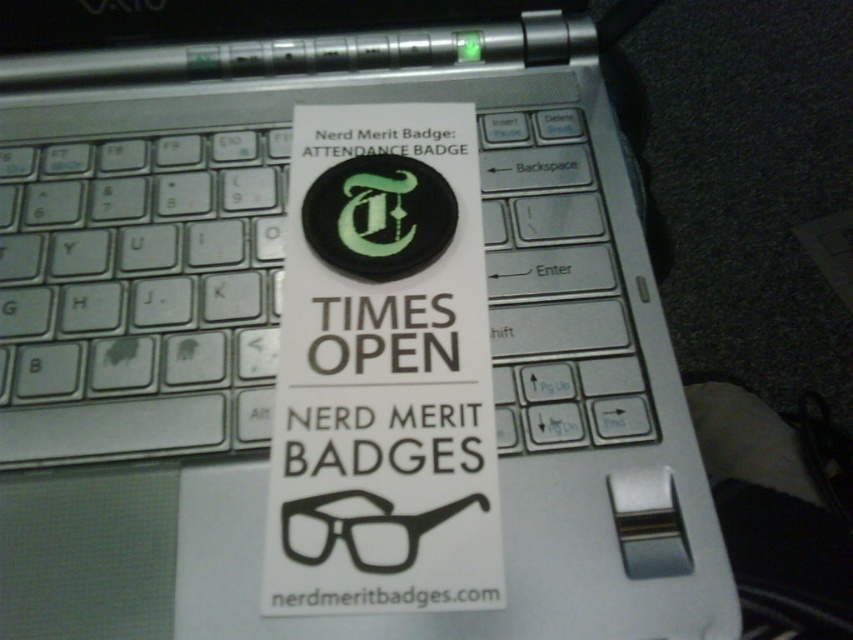
You are trying to see the website address on the black matte glasses at center but there is a white paper sticker at center covering it. Can you see the website address on the glasses?

The white paper sticker at center is in front of the black matte glasses at center, so the website address on the glasses is covered and cannot be seen.